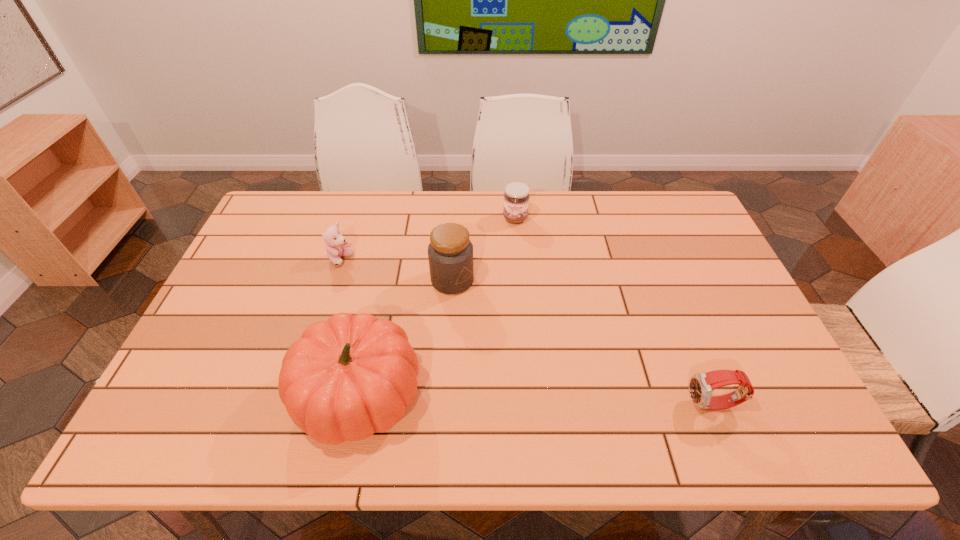
In order to click on pumpkin positioned at the near edge in this screenshot , I will do `click(344, 379)`.

Locate an element on the screen. watch that is at the near edge is located at coordinates (701, 385).

Where is `object that is at the right edge`? object that is at the right edge is located at coordinates (701, 385).

Locate an element on the screen. The image size is (960, 540). object positioned at the near right corner is located at coordinates (701, 385).

Identify the location of vacant region at the far edge of the desktop. (584, 193).

The height and width of the screenshot is (540, 960). In the image, there is a desktop. Find the location of `vacant space at the near edge`. vacant space at the near edge is located at coordinates (587, 388).

The image size is (960, 540). I want to click on free space at the left edge of the desktop, so click(x=200, y=345).

Locate an element on the screen. The height and width of the screenshot is (540, 960). vacant region at the right edge of the desktop is located at coordinates (702, 269).

Find the location of a particular element. This screenshot has height=540, width=960. blank region between the farthest object and the jar is located at coordinates (484, 249).

I want to click on unoccupied area between the teddy bear and the farthest object, so click(428, 239).